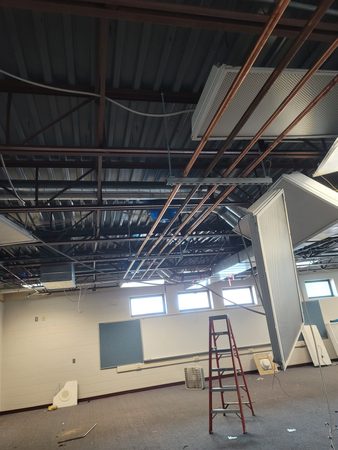
This screenshot has height=450, width=338. Find the location of `wall`. wall is located at coordinates (29, 374).